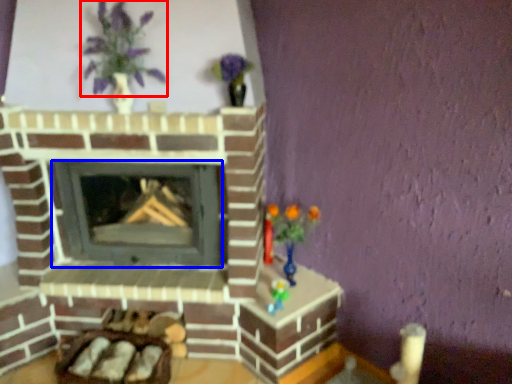
Question: Among these objects, which one is nearest to the camera, floral arrangement (highlighted by a red box) or wood burning stove (highlighted by a blue box)?

Choices:
 (A) floral arrangement
 (B) wood burning stove

Answer: (A)